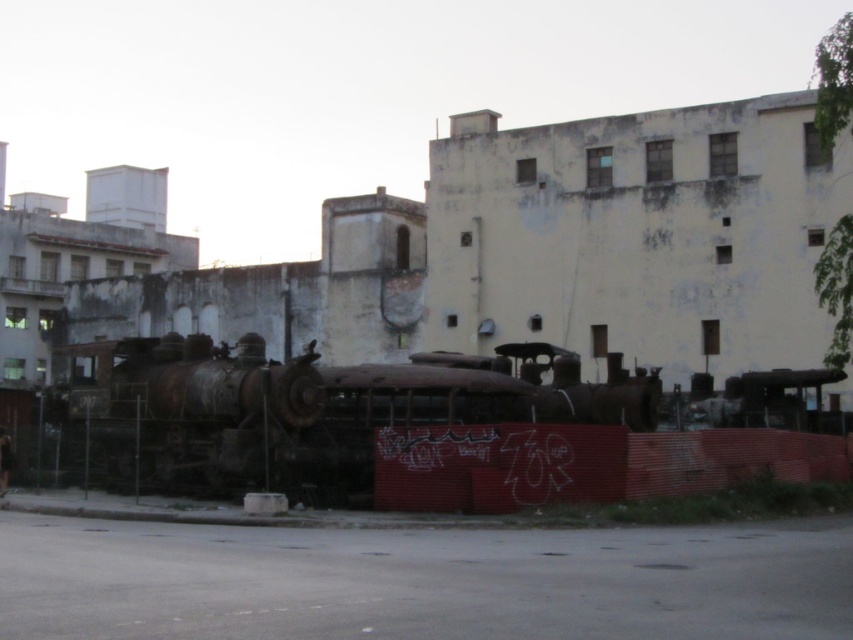
Question: Which object is closer to the camera taking this photo?

Choices:
 (A) rusty metal steam locomotive at left
 (B) rusty metal train at center

Answer: (B)

Question: Can you confirm if rusty metal train at center is positioned to the left of rusty metal steam locomotive at left?

Choices:
 (A) no
 (B) yes

Answer: (A)

Question: Can you confirm if rusty metal train at center is wider than rusty metal steam locomotive at left?

Choices:
 (A) no
 (B) yes

Answer: (B)

Question: Can you confirm if rusty metal train at center is thinner than rusty metal steam locomotive at left?

Choices:
 (A) no
 (B) yes

Answer: (A)